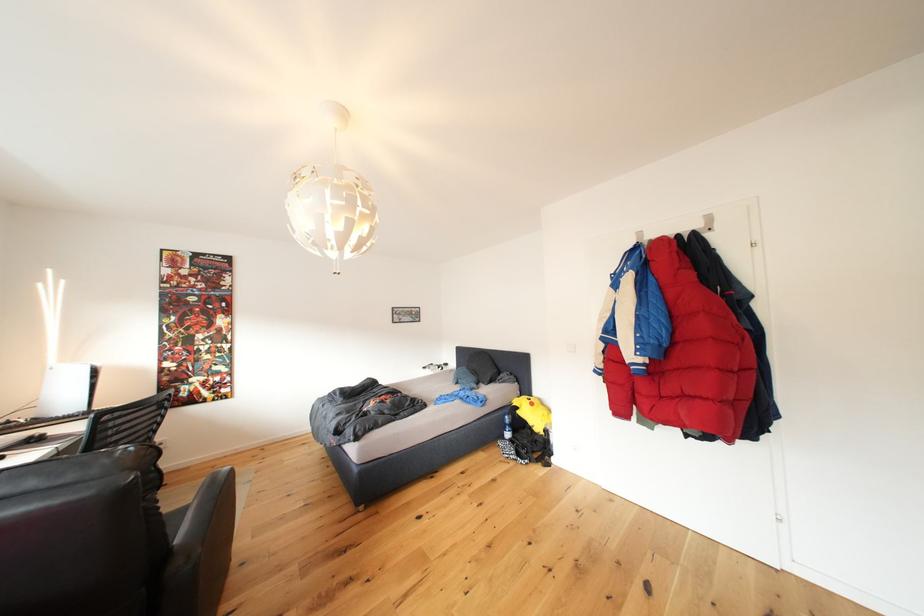
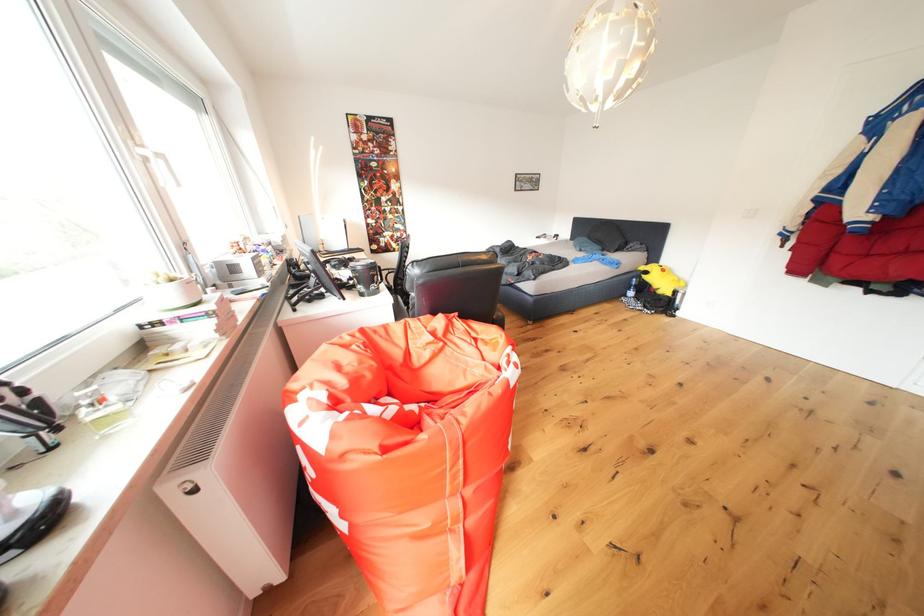
In the second image, find the point that corresponds to pixel 527 416 in the first image.

(653, 282)